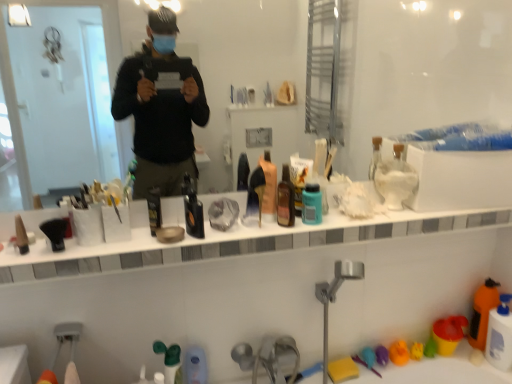
Image resolution: width=512 pixels, height=384 pixels. Identify the location of free space to the left of black matte bottle at center. (152, 240).